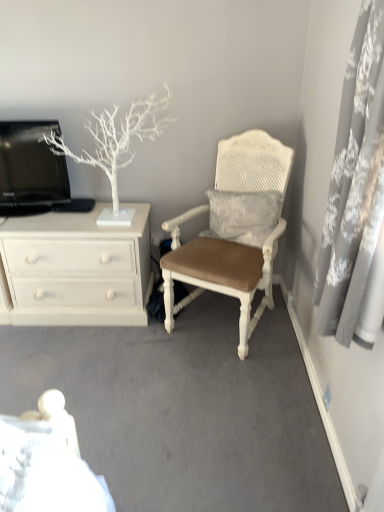
Where is `vacant space in gray lace curtain at right (from a real-world perspective)`? This screenshot has height=512, width=384. vacant space in gray lace curtain at right (from a real-world perspective) is located at coordinates (310, 456).